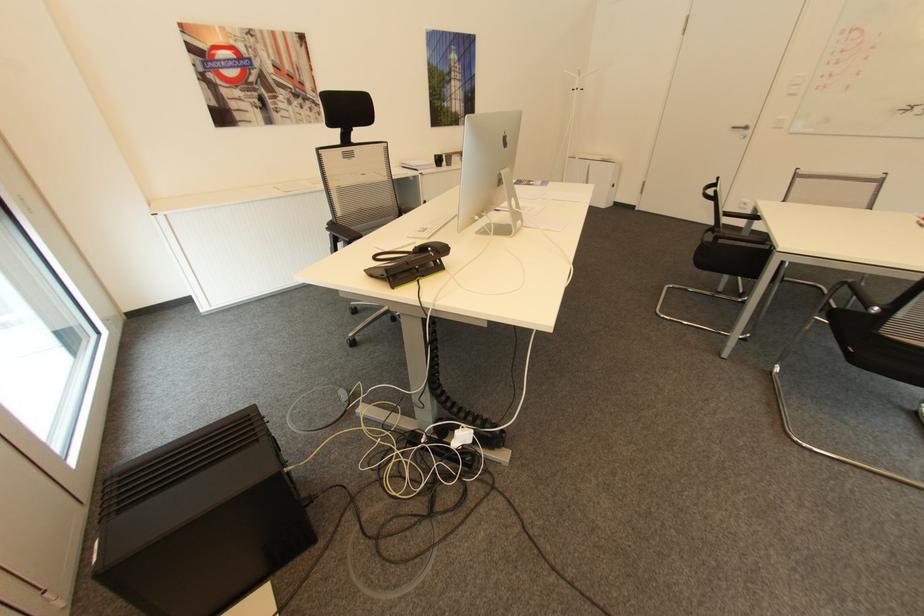
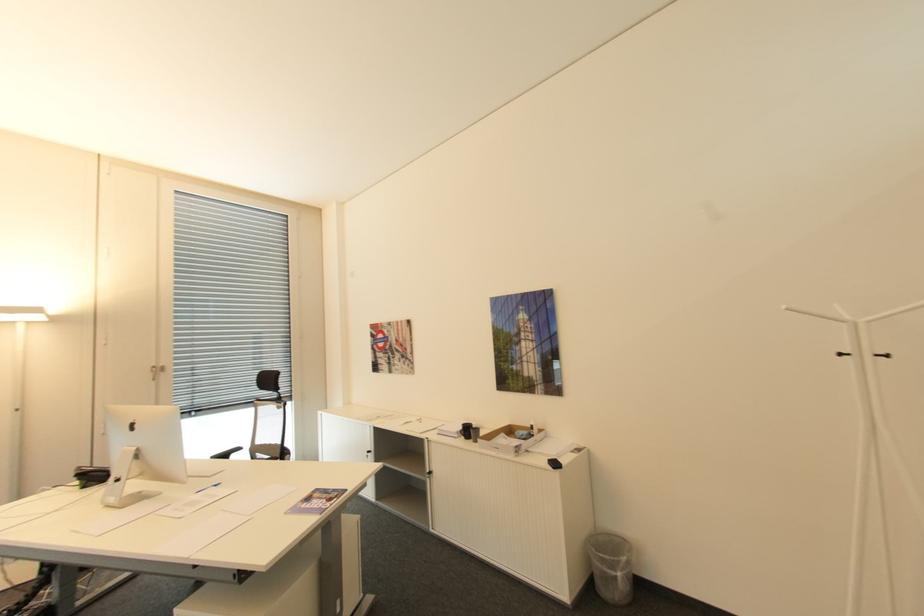
Where in the second image is the point corresponding to (x=441, y=155) from the first image?

(468, 424)